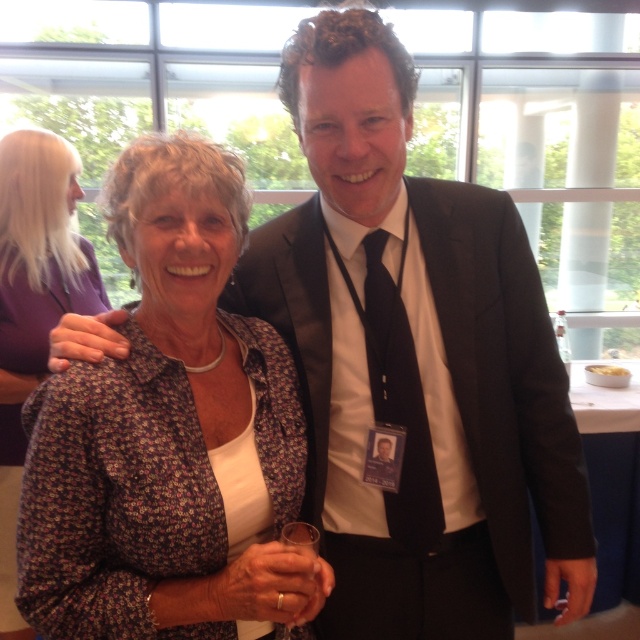
You are at an event and need to introduce yourself to someone. You see a floral fabric blouse at center and a black silk tie at center. Which one is more to the left?

The floral fabric blouse at center is positioned on the left side of black silk tie at center, so the floral fabric blouse at center is more to the left.

You are a photographer at an event and need to position two subjects so that their clothing items are visible. The subjects are wearing a black smooth suit at center and a floral fabric blouse at center. According to the scene, which clothing item is positioned lower and would require you to adjust your camera angle downward to capture it properly?

The black smooth suit at center is located below the floral fabric blouse at center, so you need to adjust your camera angle downward to capture the black smooth suit at center properly.